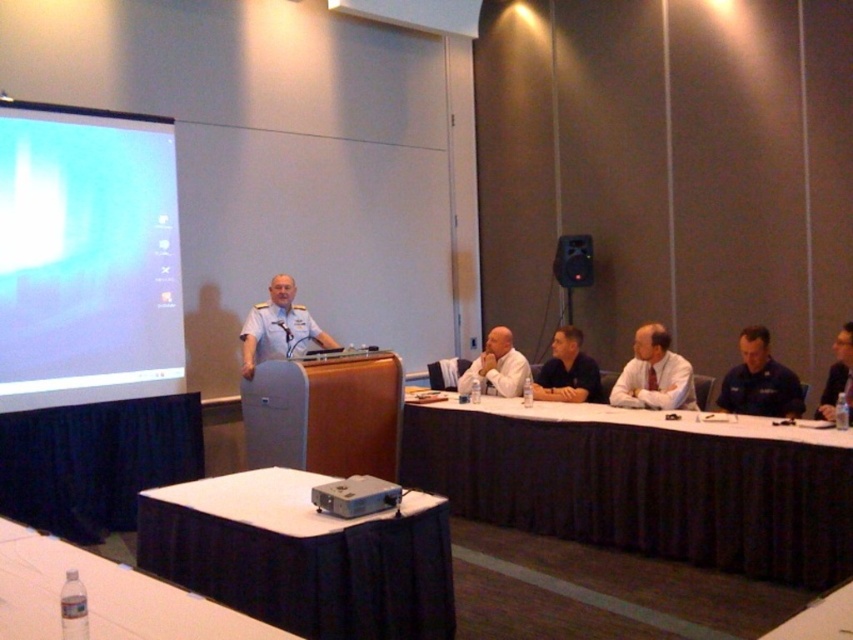
Question: Which point is farther from the camera taking this photo?

Choices:
 (A) (177, 552)
 (B) (659, 404)
 (C) (318, 484)
 (D) (590, 401)

Answer: (D)

Question: Among these points, which one is nearest to the camera?

Choices:
 (A) (567, 372)
 (B) (144, 611)
 (C) (717, 493)

Answer: (B)

Question: Is clear plastic bottle at lower left bigger than dark blue shirt at right?

Choices:
 (A) yes
 (B) no

Answer: (B)

Question: Is white shirt at center positioned in front of dark blue shirt at center?

Choices:
 (A) yes
 (B) no

Answer: (A)

Question: Among these points, which one is farthest from the camera?

Choices:
 (A) (291, 333)
 (B) (834, 611)
 (C) (474, 445)
 (D) (112, 264)

Answer: (A)

Question: Does clear plastic bottle at lower left appear over white matte shirt at center?

Choices:
 (A) no
 (B) yes

Answer: (A)